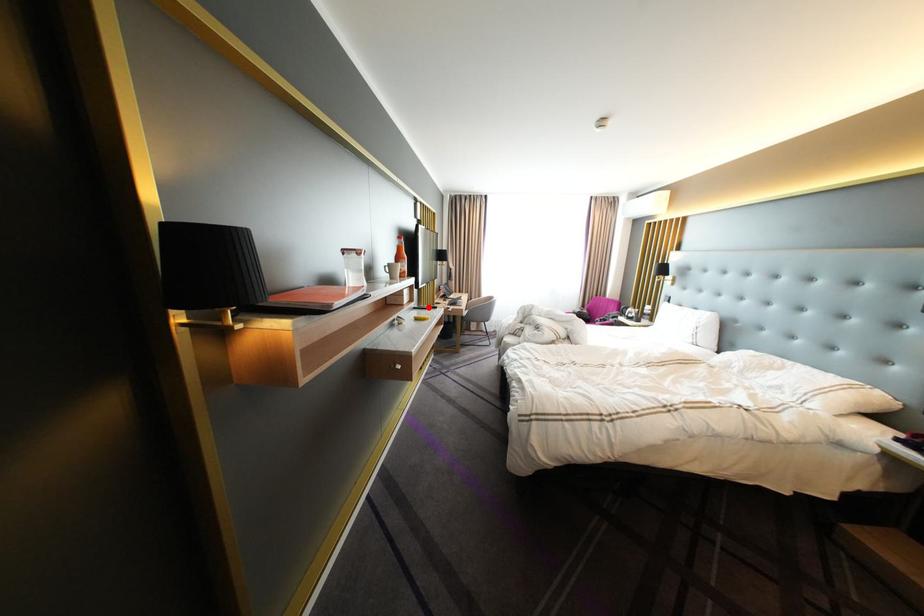
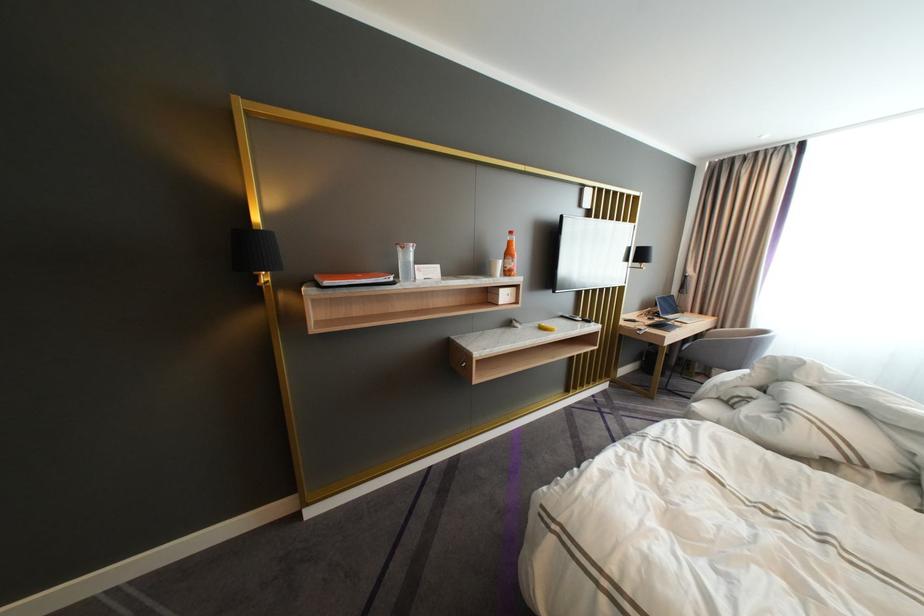
Question: I am providing you with two images of the same scene from different viewpoints. A red point is marked on the first image. Can you still see the location of the red point in image 2?

Choices:
 (A) Yes
 (B) No

Answer: (A)